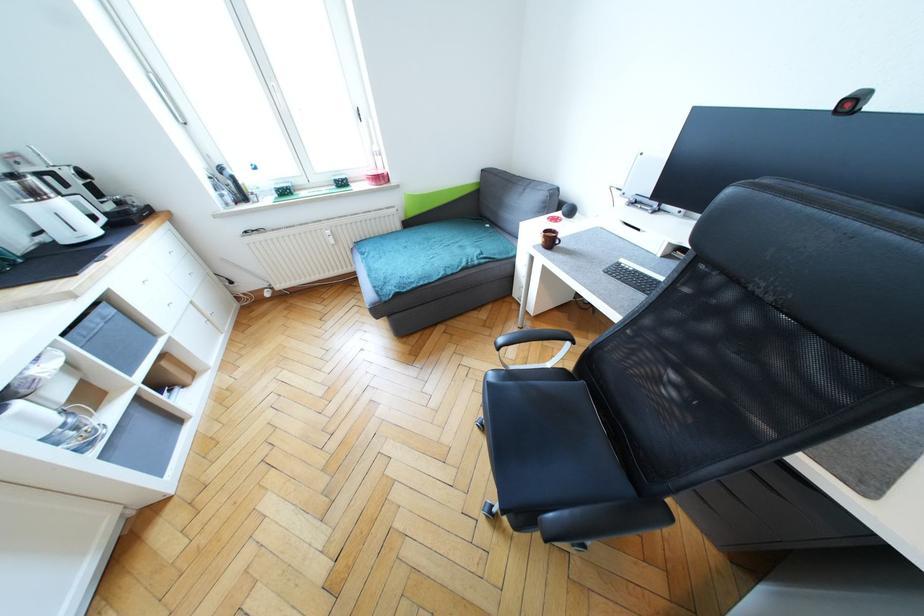
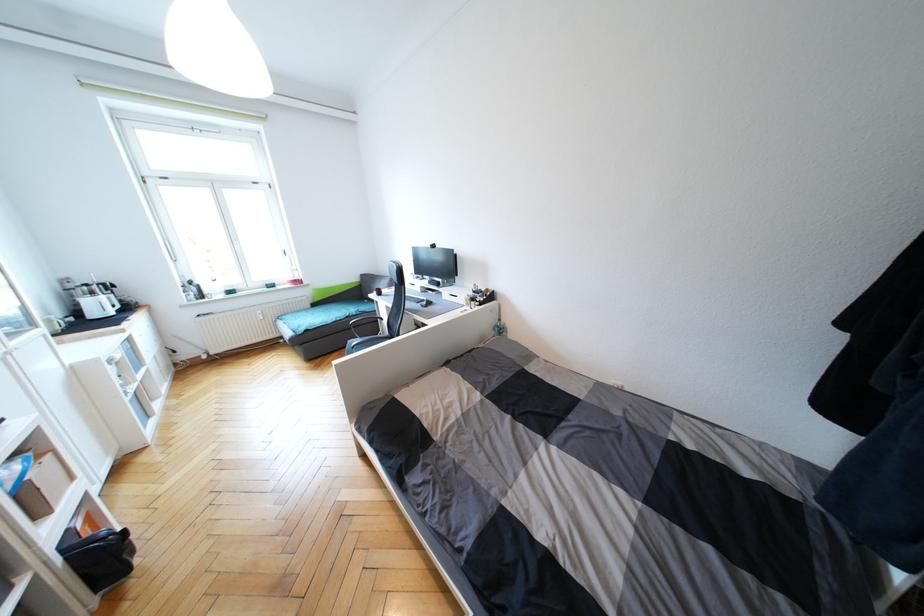
Question: I am providing you with two images of the same scene from different viewpoints. Which of the following objects are not visible in image2?

Choices:
 (A) black chair sitting surface
 (B) silver utensil holder
 (C) sofa sitting surface
 (D) brown coffee mug

Answer: (D)